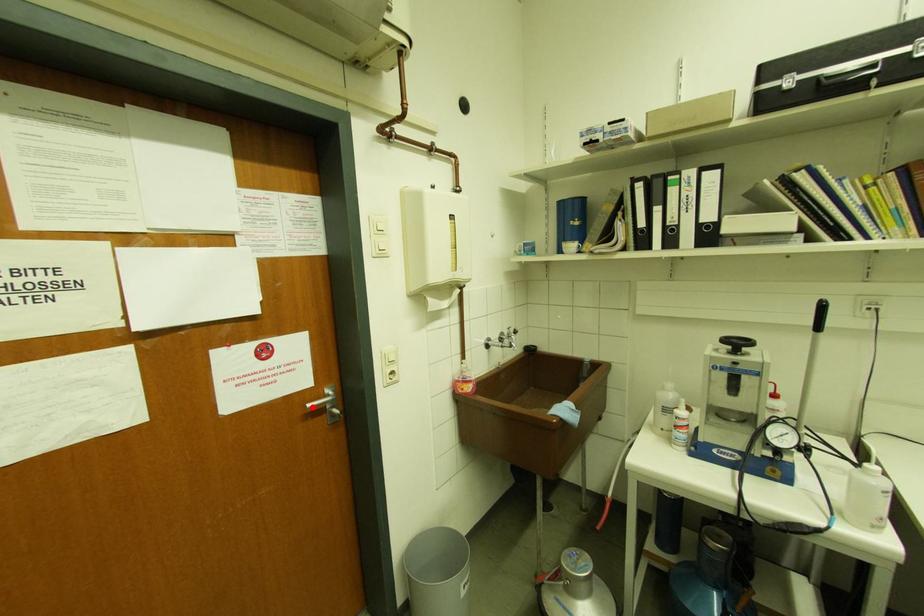
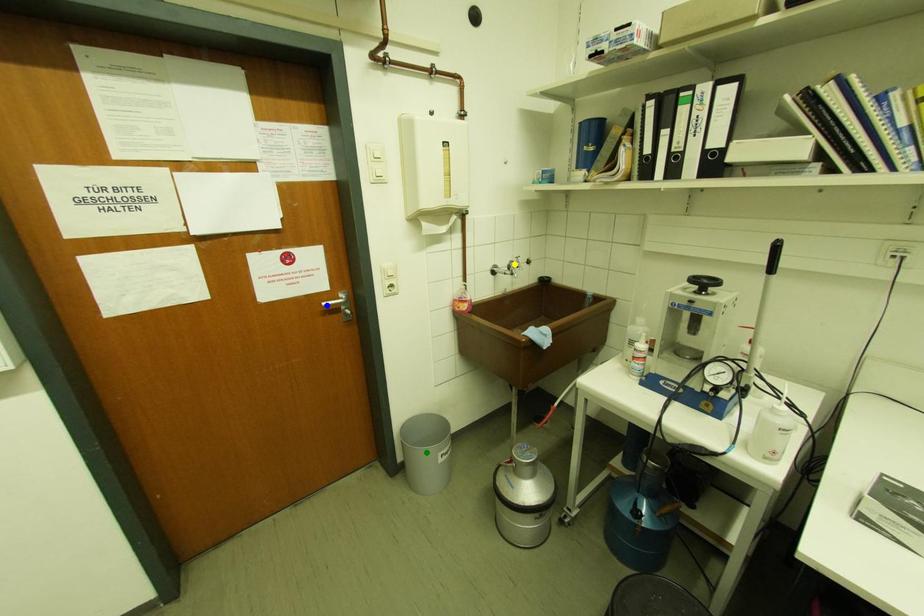
Question: I am providing you with two images of the same scene from different viewpoints. A red point is marked on the first image. You are given multiple points on the second image. In image 2, which mark is for the same physical point as the one in image 1?

Choices:
 (A) blue point
 (B) yellow point
 (C) green point

Answer: (A)